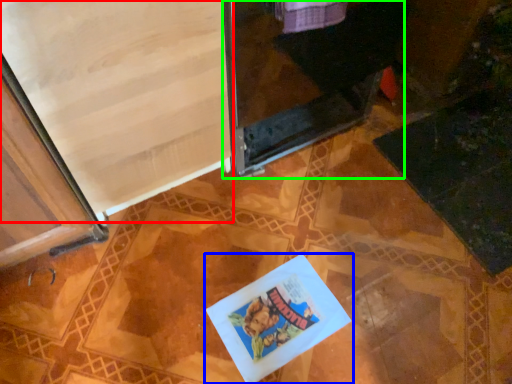
Question: Which object is the farthest from screen door (highlighted by a red box)? Choose among these: book (highlighted by a blue box) or screen door (highlighted by a green box).

Choices:
 (A) book
 (B) screen door

Answer: (A)